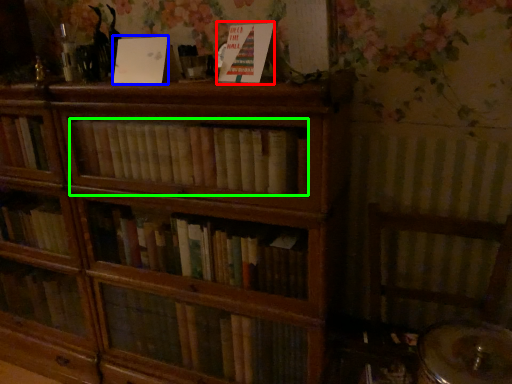
Question: Considering the real-world distances, which object is farthest from paperback book (highlighted by a red box)? paperback book (highlighted by a blue box) or book (highlighted by a green box)?

Choices:
 (A) paperback book
 (B) book

Answer: (B)